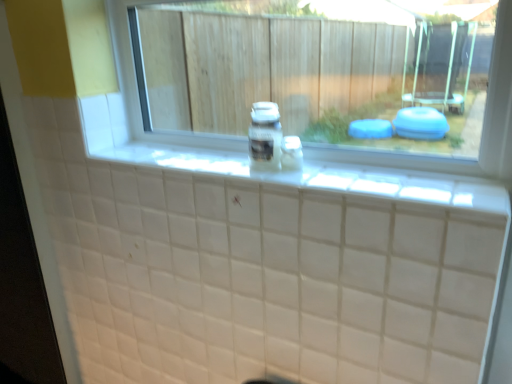
I want to click on empty space that is to the right of clear plastic bottle at center, so click(328, 170).